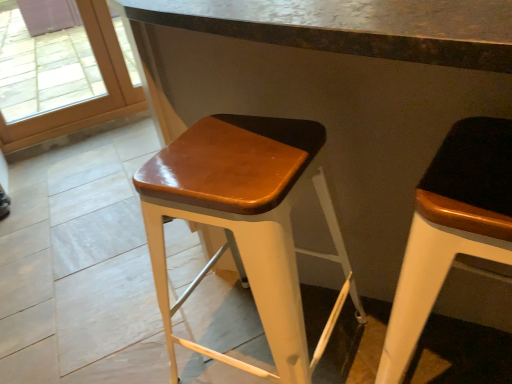
Question: Is transparent glass door at upper left at the left side of matte black stool at right, which is the second stool from left to right?

Choices:
 (A) no
 (B) yes

Answer: (B)

Question: From a real-world perspective, is transparent glass door at upper left over matte black stool at right, the 1th stool positioned from the right?

Choices:
 (A) yes
 (B) no

Answer: (A)

Question: Is transparent glass door at upper left smaller than matte black stool at right, which is the second stool from left to right?

Choices:
 (A) no
 (B) yes

Answer: (A)

Question: Considering the relative sizes of transparent glass door at upper left and matte black stool at right, the 1th stool positioned from the right, in the image provided, is transparent glass door at upper left thinner than matte black stool at right, the 1th stool positioned from the right,?

Choices:
 (A) no
 (B) yes

Answer: (B)

Question: Does transparent glass door at upper left have a larger size compared to matte black stool at right, the 1th stool positioned from the right?

Choices:
 (A) yes
 (B) no

Answer: (A)

Question: Is matte black stool at right, the 1th stool positioned from the right, inside or outside of glossy wood stool at center, which ranks as the 1th stool in left-to-right order?

Choices:
 (A) inside
 (B) outside

Answer: (B)

Question: Based on their positions, is matte black stool at right, which is the second stool from left to right, located to the left or right of glossy wood stool at center, which ranks as the 1th stool in left-to-right order?

Choices:
 (A) right
 (B) left

Answer: (A)

Question: Is matte black stool at right, which is the second stool from left to right, wider or thinner than glossy wood stool at center, acting as the second stool starting from the right?

Choices:
 (A) thin
 (B) wide

Answer: (A)

Question: From the image's perspective, is matte black stool at right, the 1th stool positioned from the right, positioned above or below glossy wood stool at center, acting as the second stool starting from the right?

Choices:
 (A) below
 (B) above

Answer: (A)

Question: From a real-world perspective, is transparent glass door at upper left above or below matte black stool at right, which is the second stool from left to right?

Choices:
 (A) below
 (B) above

Answer: (B)

Question: Does point (91, 104) appear closer or farther from the camera than point (385, 349)?

Choices:
 (A) closer
 (B) farther

Answer: (B)

Question: Considering the positions of transparent glass door at upper left and matte black stool at right, which is the second stool from left to right, in the image, is transparent glass door at upper left wider or thinner than matte black stool at right, which is the second stool from left to right,?

Choices:
 (A) thin
 (B) wide

Answer: (A)

Question: From the image's perspective, is transparent glass door at upper left positioned above or below matte black stool at right, the 1th stool positioned from the right?

Choices:
 (A) above
 (B) below

Answer: (A)

Question: From the image's perspective, is transparent glass door at upper left located above or below glossy wood stool at center, acting as the second stool starting from the right?

Choices:
 (A) below
 (B) above

Answer: (B)

Question: Visually, is transparent glass door at upper left positioned to the left or to the right of glossy wood stool at center, acting as the second stool starting from the right?

Choices:
 (A) left
 (B) right

Answer: (A)